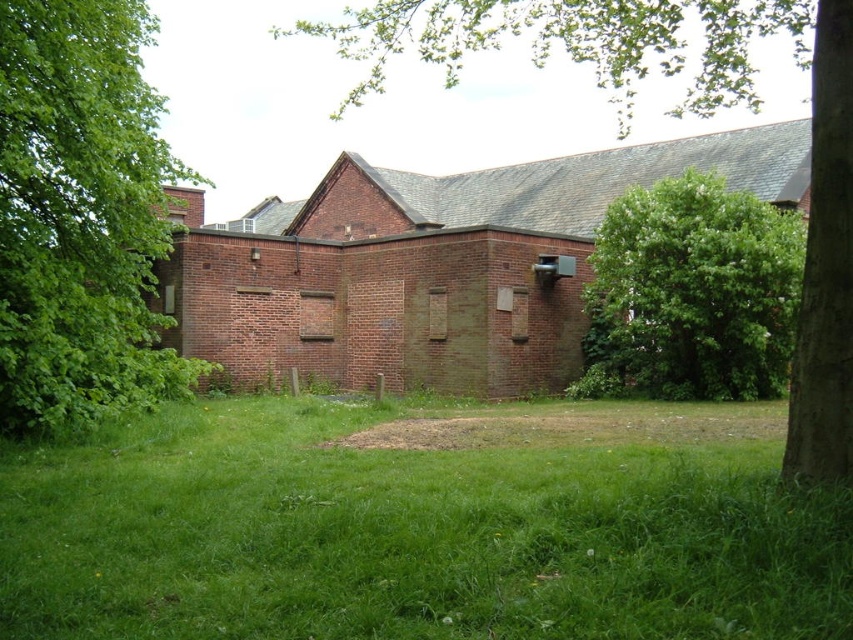
You are standing at the entrance of the brick building and want to walk to the green grass at center. Which direction should you head to reach it?

The green grass at center is located at coordinates point (422,525), so you should head towards the center of the lawn to reach it.

You are standing on the lawn looking towards the brick building. There are two green leafy trees in front of you. Which tree, the green leafy tree at left or the green leafy tree at center, is closer to you?

The green leafy tree at left is closer to you because the green leafy tree at center is behind it.

You are standing at the point labeled point [80,216] in the image. Looking around, you see a brick building with boarded windows and a lawn with a small patch of bare earth. What is the nearest object to your current position?

The nearest object to your current position is the green leafy tree at left, as the point [80,216] corresponds to its location.